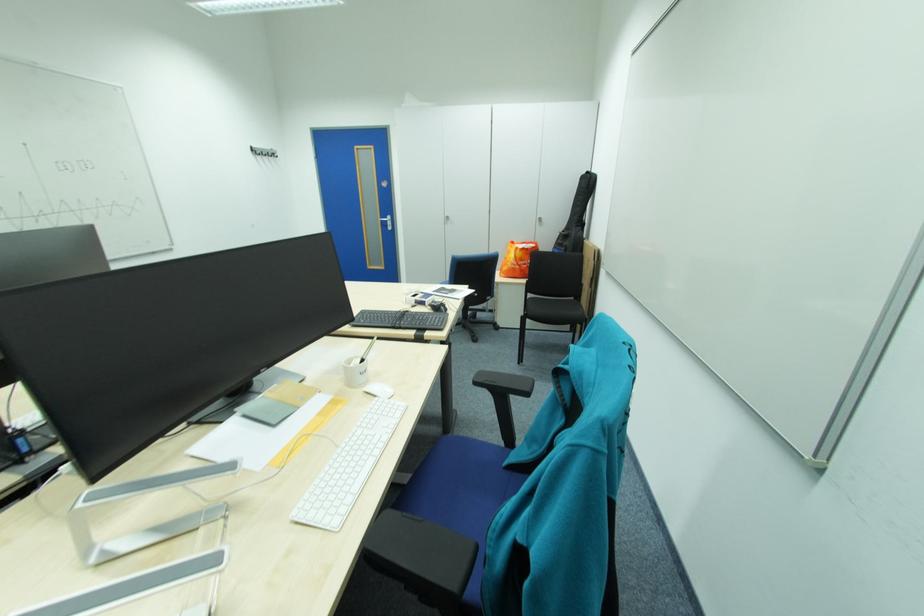
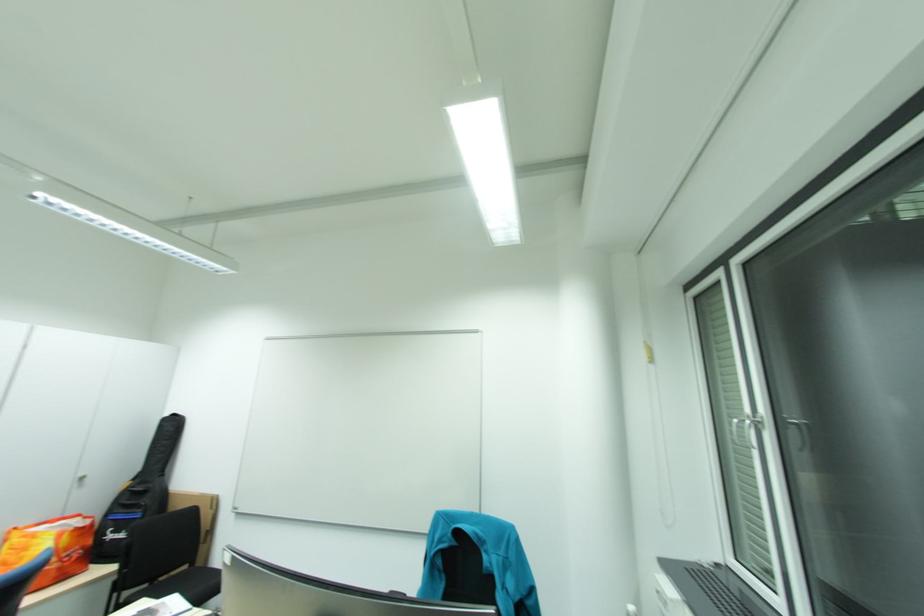
Where in the second image is the point corresponding to point (580, 298) from the first image?

(193, 568)